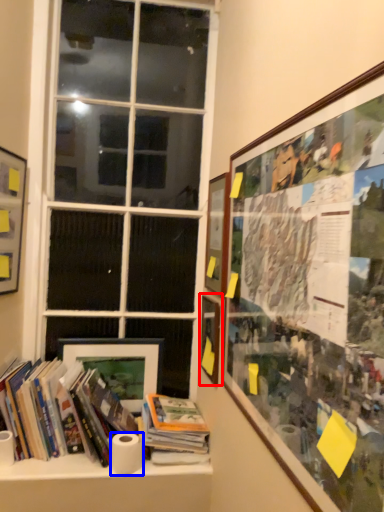
Question: Which of the following is the farthest to the observer, picture frame (highlighted by a red box) or toilet paper (highlighted by a blue box)?

Choices:
 (A) picture frame
 (B) toilet paper

Answer: (A)